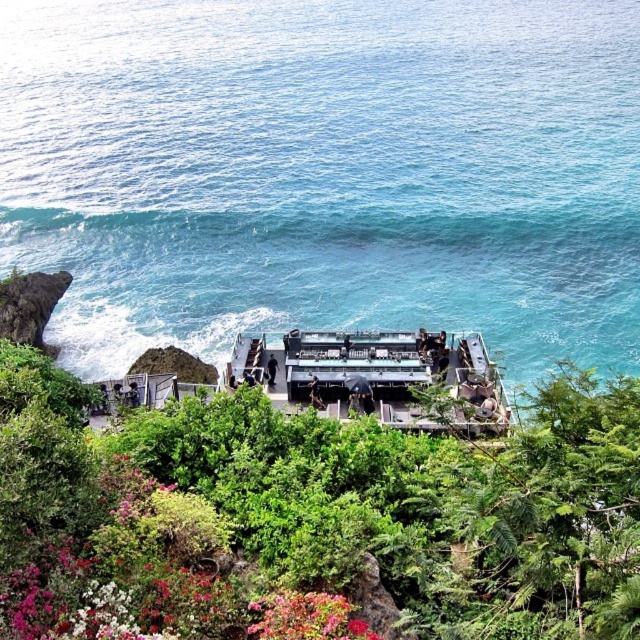
Find the location of a particular element. blue water at center is located at coordinates (324, 172).

Locate an element on the screen. The height and width of the screenshot is (640, 640). blue water at center is located at coordinates (324, 172).

At what (x,y) coordinates should I click in order to perform the action: click on blue water at center. Please return your answer as a coordinate pair (x, y). The height and width of the screenshot is (640, 640). Looking at the image, I should click on (324, 172).

Between green leafy foliage at center and vibrant red petals at lower center, which one appears on the left side from the viewer's perspective?

From the viewer's perspective, green leafy foliage at center appears more on the left side.

The height and width of the screenshot is (640, 640). Describe the element at coordinates (317, 509) in the screenshot. I see `green leafy foliage at center` at that location.

Between point (173, 628) and point (317, 593), which one is positioned in front?

Point (173, 628) is more forward.

What are the coordinates of `green leafy foliage at center` in the screenshot? It's located at (317, 509).

Is metallic gray boat at center positioned in front of vibrant red petals at lower center?

No, metallic gray boat at center is further to the viewer.

Between metallic gray boat at center and vibrant red petals at lower center, which one has more height?

Standing taller between the two is metallic gray boat at center.

Does point (372, 403) come in front of point (365, 632)?

That is False.

Find the location of a particular element. This screenshot has height=640, width=640. metallic gray boat at center is located at coordinates (380, 376).